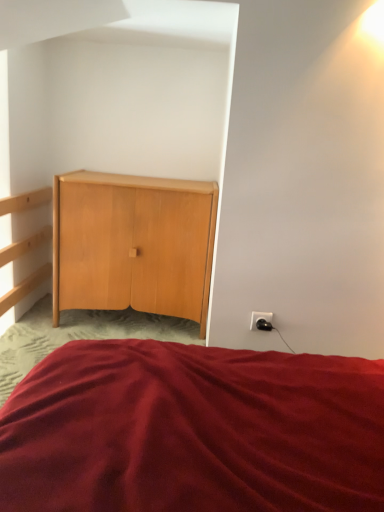
Question: Is light wood cabinet at center further to camera compared to burgundy fabric bed at center?

Choices:
 (A) yes
 (B) no

Answer: (A)

Question: Is light wood cabinet at center wider than burgundy fabric bed at center?

Choices:
 (A) yes
 (B) no

Answer: (B)

Question: From a real-world perspective, is light wood cabinet at center physically below burgundy fabric bed at center?

Choices:
 (A) yes
 (B) no

Answer: (B)

Question: Considering the relative sizes of light wood cabinet at center and burgundy fabric bed at center in the image provided, is light wood cabinet at center bigger than burgundy fabric bed at center?

Choices:
 (A) no
 (B) yes

Answer: (A)

Question: Is light wood cabinet at center in front of burgundy fabric bed at center?

Choices:
 (A) yes
 (B) no

Answer: (B)

Question: Looking at their shapes, would you say burgundy fabric bed at center is wider or thinner than light wood cabinet at center?

Choices:
 (A) thin
 (B) wide

Answer: (B)

Question: From the image's perspective, relative to light wood cabinet at center, is burgundy fabric bed at center above or below?

Choices:
 (A) below
 (B) above

Answer: (A)

Question: Is burgundy fabric bed at center in front of or behind light wood cabinet at center in the image?

Choices:
 (A) front
 (B) behind

Answer: (A)

Question: Is point (36, 458) positioned closer to the camera than point (165, 293)?

Choices:
 (A) farther
 (B) closer

Answer: (B)

Question: From the image's perspective, relative to black plastic outlet at lower right, is light wood cabinet at center above or below?

Choices:
 (A) below
 (B) above

Answer: (B)

Question: Looking at the image, does light wood cabinet at center seem bigger or smaller compared to black plastic outlet at lower right?

Choices:
 (A) small
 (B) big

Answer: (B)

Question: Is point (69, 274) positioned closer to the camera than point (256, 314)?

Choices:
 (A) closer
 (B) farther

Answer: (B)

Question: Looking at their shapes, would you say light wood cabinet at center is wider or thinner than black plastic outlet at lower right?

Choices:
 (A) thin
 (B) wide

Answer: (B)

Question: Considering the positions of point coord(261,312) and point coord(226,429), is point coord(261,312) closer or farther from the camera than point coord(226,429)?

Choices:
 (A) farther
 (B) closer

Answer: (A)

Question: Is black plastic outlet at lower right wider or thinner than burgundy fabric bed at center?

Choices:
 (A) wide
 (B) thin

Answer: (B)